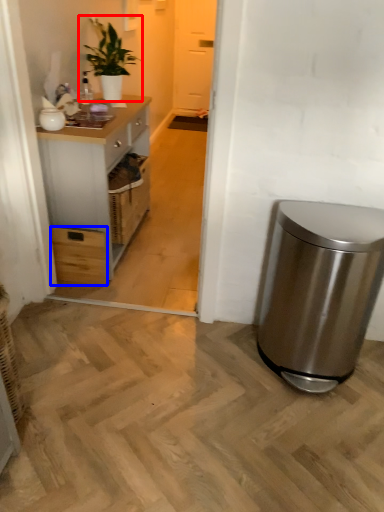
Question: Which object is further to the camera taking this photo, houseplant (highlighted by a red box) or drawer (highlighted by a blue box)?

Choices:
 (A) houseplant
 (B) drawer

Answer: (A)